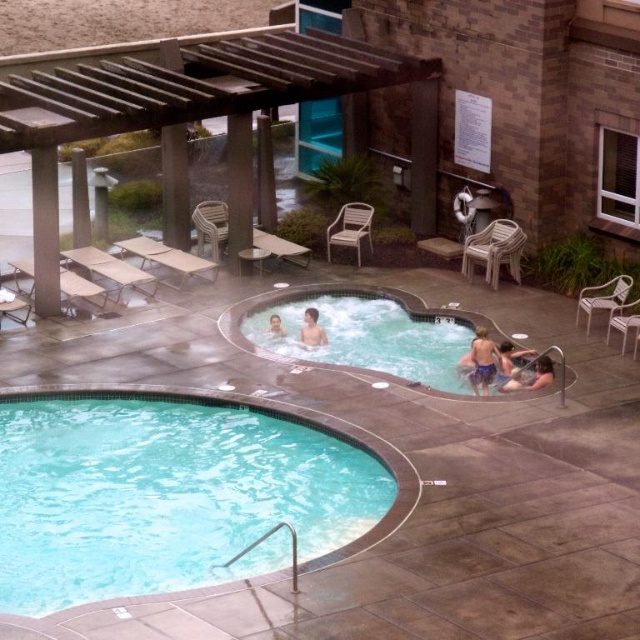
Question: Which point is farther to the camera?

Choices:
 (A) (112, 275)
 (B) (476, 326)
 (C) (513, 381)
 (D) (81, 276)

Answer: (D)

Question: Which point is closer to the camera taking this photo?

Choices:
 (A) (72, 292)
 (B) (364, 227)
 (C) (477, 244)
 (D) (305, 321)

Answer: (D)

Question: Which of the following is the farthest from the observer?

Choices:
 (A) (630, 321)
 (B) (266, 556)
 (C) (621, 298)

Answer: (C)

Question: Does white metal chair at right appear under beige plastic chair at left?

Choices:
 (A) no
 (B) yes

Answer: (B)

Question: In this image, where is clear blue water at lower left located relative to white plastic chair at right?

Choices:
 (A) left
 (B) right

Answer: (A)

Question: Is wicker chair at right smaller than smooth blue shorts at lower right?

Choices:
 (A) yes
 (B) no

Answer: (B)